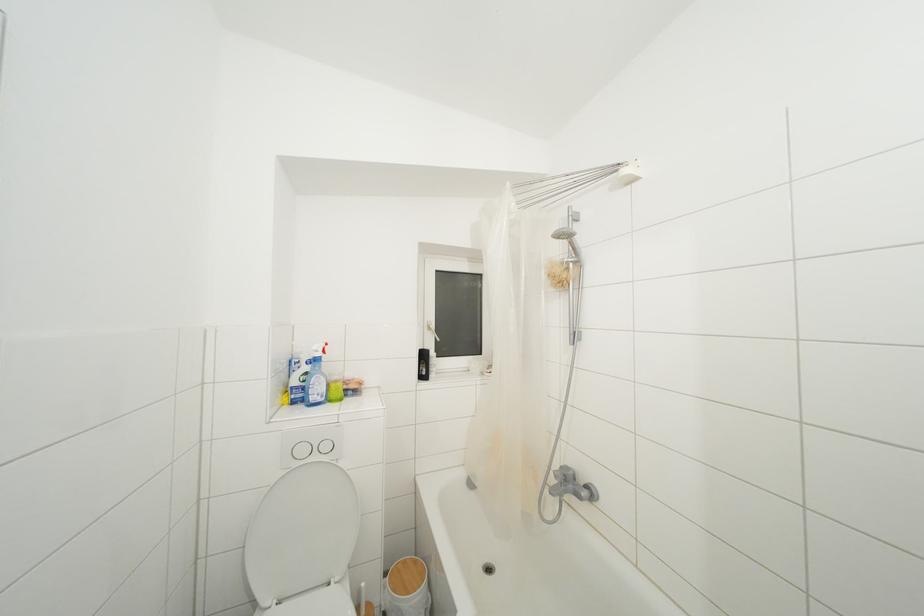
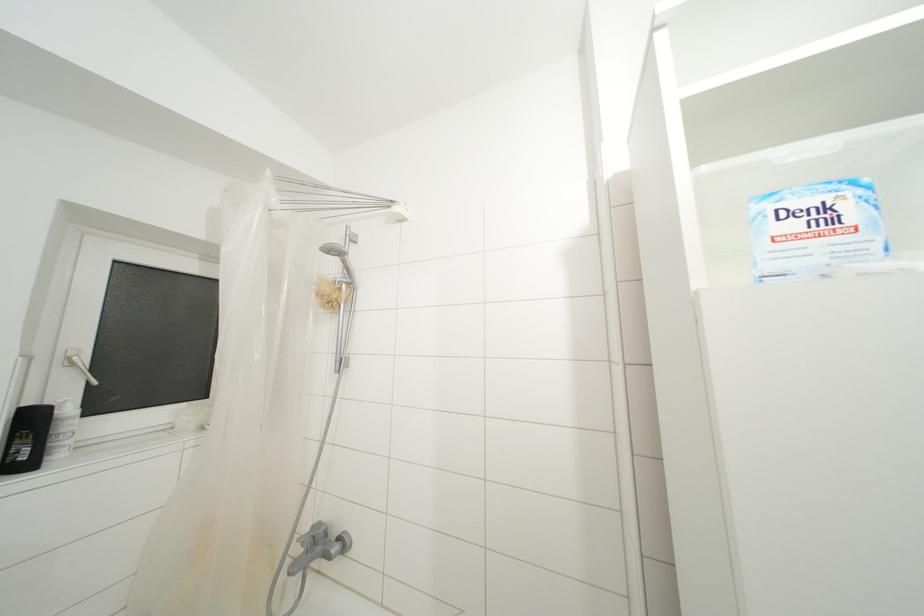
Question: Based on the continuous images, in which direction is the camera rotating? Reply with the corresponding letter.

Choices:
 (A) Left
 (B) Right
 (C) Up
 (D) Down

Answer: (B)